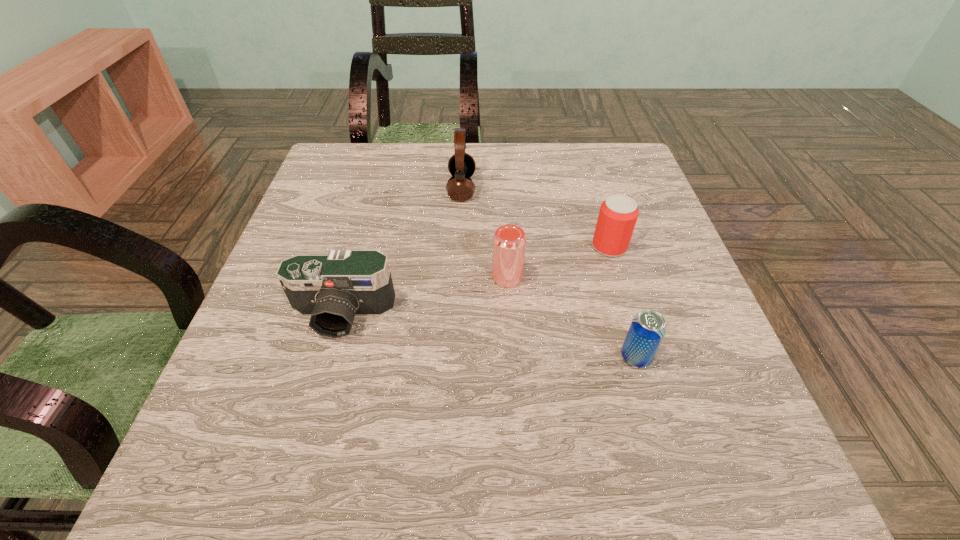
Find the location of a particular element. vacant region that satisfies the following two spatial constraints: 1. on the ear pads of the nearest object; 2. on the left side of the fourth object from right to left is located at coordinates (453, 357).

Where is `vacant space that satisfies the following two spatial constraints: 1. on the ear pads of the headset; 2. on the left side of the nearest beer can`? This screenshot has height=540, width=960. vacant space that satisfies the following two spatial constraints: 1. on the ear pads of the headset; 2. on the left side of the nearest beer can is located at coordinates (453, 357).

Where is `vacant area that satisfies the following two spatial constraints: 1. on the ear pads of the farthest beer can; 2. on the left side of the farthest object`? The image size is (960, 540). vacant area that satisfies the following two spatial constraints: 1. on the ear pads of the farthest beer can; 2. on the left side of the farthest object is located at coordinates (459, 247).

In order to click on free space that satisfies the following two spatial constraints: 1. on the front side of the nearest object; 2. on the left side of the second nearest beer can in this screenshot , I will do `click(512, 357)`.

The height and width of the screenshot is (540, 960). Identify the location of free space that satisfies the following two spatial constraints: 1. on the front-facing side of the leftmost object; 2. on the right side of the nearest object. (330, 357).

I want to click on blank area in the image that satisfies the following two spatial constraints: 1. on the back side of the farthest beer can; 2. on the right side of the nearest object, so click(604, 247).